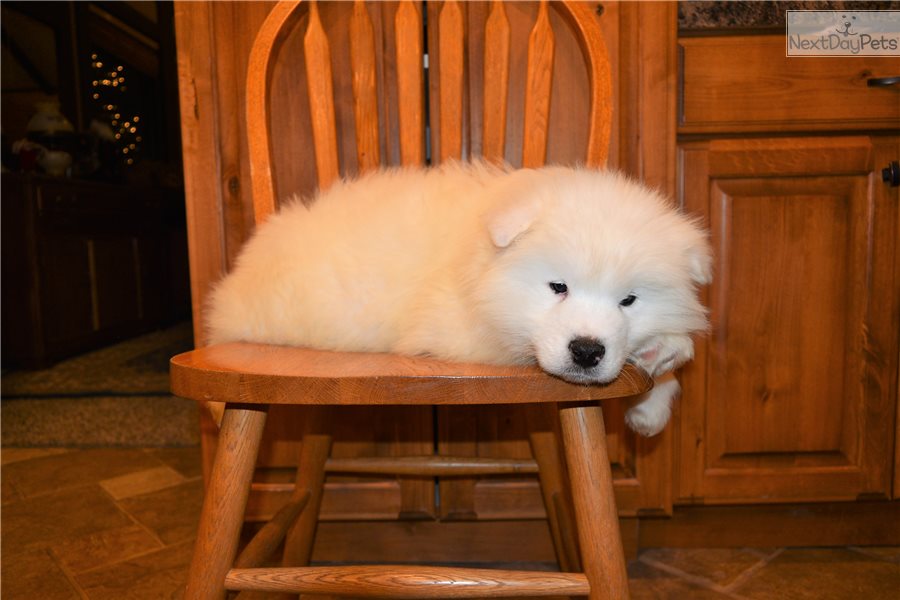
Locate an element on the screen. Image resolution: width=900 pixels, height=600 pixels. floor is located at coordinates (105, 506).